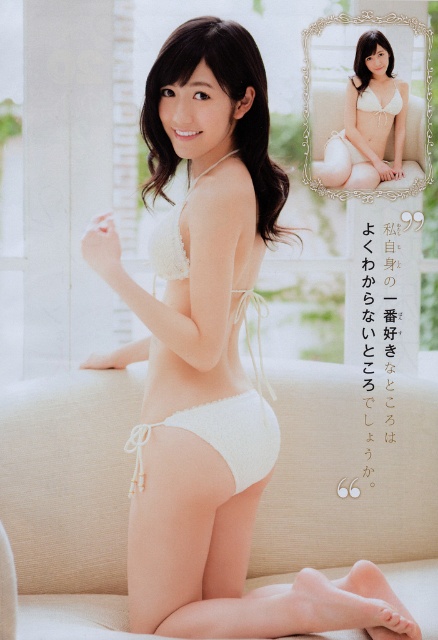
Can you confirm if white lace bra at upper right is positioned below white soft fabric bikini bottom at lower center?

No.

Is point (331, 168) closer to camera compared to point (236, 400)?

No, it is behind (236, 400).

Who is more forward, (349, 113) or (272, 429)?

Point (272, 429) is in front.

Where is `white lace bra at upper right`? white lace bra at upper right is located at coordinates (367, 120).

Does white crochet bikini at center have a lesser height compared to white soft fabric bikini bottom at lower center?

No.

Is white crochet bikini at center further to camera compared to white soft fabric bikini bottom at lower center?

That is False.

Is point (258, 477) positioned in front of point (229, 416)?

No, (258, 477) is behind (229, 416).

The width and height of the screenshot is (438, 640). In order to click on white crochet bikini at center in this screenshot , I will do `click(223, 433)`.

Who is positioned more to the right, white soft bikini at center or white crochet bikini at center?

white soft bikini at center

Locate an element on the screen. The width and height of the screenshot is (438, 640). white soft bikini at center is located at coordinates (232, 104).